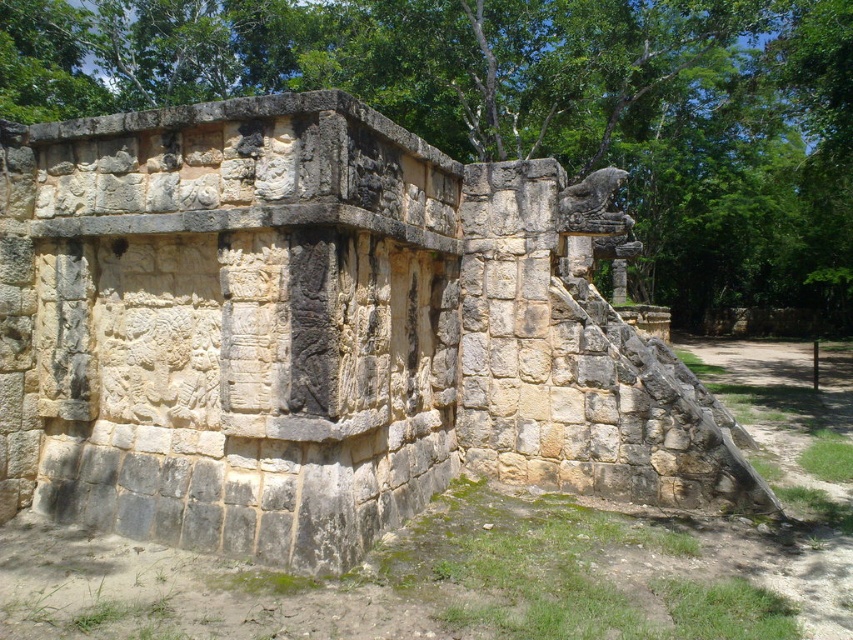
Where is `natural stone wall at center`? This screenshot has width=853, height=640. natural stone wall at center is located at coordinates (318, 333).

Is natural stone wall at center to the left of green leafy tree at upper center from the viewer's perspective?

Indeed, natural stone wall at center is positioned on the left side of green leafy tree at upper center.

This screenshot has width=853, height=640. What are the coordinates of `natural stone wall at center` in the screenshot? It's located at (318, 333).

I want to click on natural stone wall at center, so click(x=318, y=333).